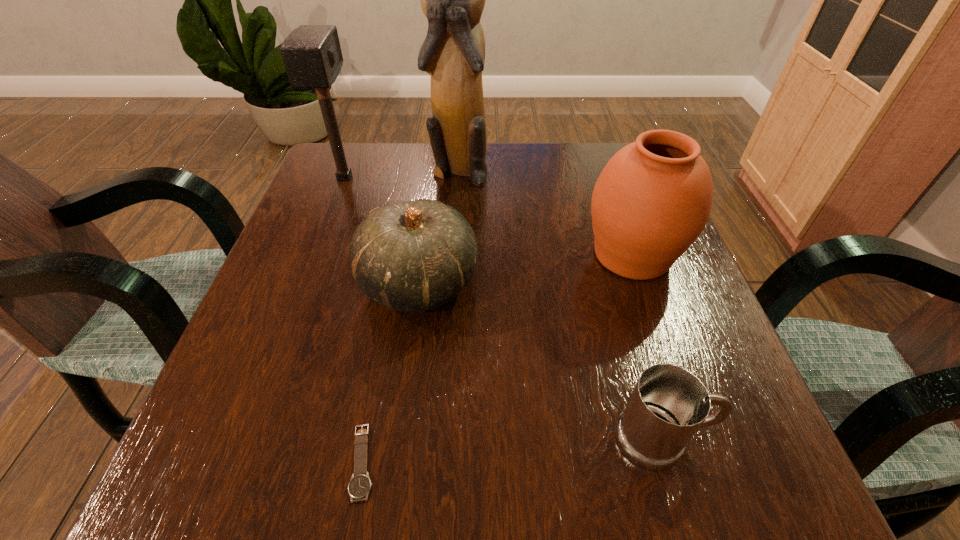
Identify the location of cat. The width and height of the screenshot is (960, 540). (453, 53).

Locate an element on the screen. The height and width of the screenshot is (540, 960). the leftmost object is located at coordinates (312, 55).

Locate an element on the screen. mallet is located at coordinates (312, 55).

What are the coordinates of `the fourth shortest object` in the screenshot? It's located at (652, 200).

Find the location of a particular element. The image size is (960, 540). the fourth tallest object is located at coordinates (412, 256).

Locate an element on the screen. the second shortest object is located at coordinates (669, 404).

Where is `watch`? This screenshot has height=540, width=960. watch is located at coordinates (360, 484).

At what (x,y) coordinates should I click in order to perform the action: click on free spot located on the face of the tallest object. Please return your answer as a coordinate pair (x, y). Image resolution: width=960 pixels, height=540 pixels. Looking at the image, I should click on (449, 307).

This screenshot has width=960, height=540. I want to click on vacant space situated on the front of the mallet, so click(311, 266).

Where is `free spot located 0.070m on the left of the urn`? Image resolution: width=960 pixels, height=540 pixels. free spot located 0.070m on the left of the urn is located at coordinates (545, 255).